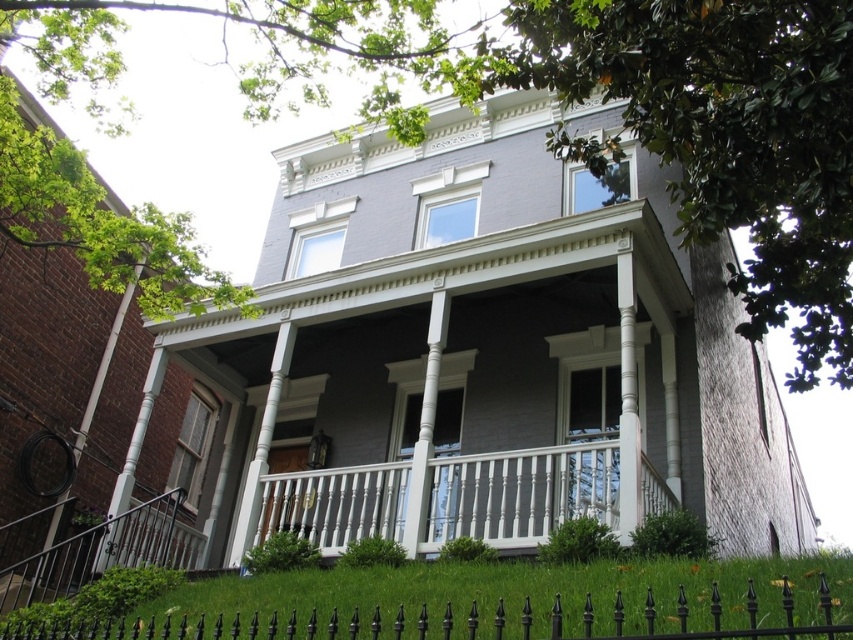
Is white painted wood porch at center to the left of black wrought iron fence at lower center from the viewer's perspective?

No, white painted wood porch at center is not to the left of black wrought iron fence at lower center.

Can you confirm if white painted wood porch at center is smaller than black wrought iron fence at lower center?

Yes.

Does point (347, 490) come behind point (671, 616)?

Yes, point (347, 490) is farther from viewer.

Find the location of a particular element. The image size is (853, 640). white painted wood porch at center is located at coordinates (450, 497).